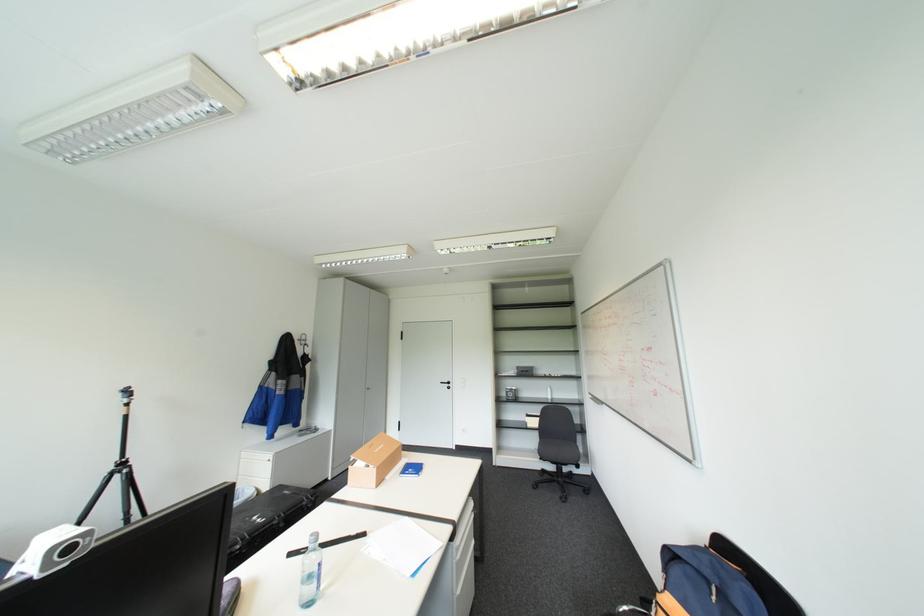
Where is `chair sitting surface`? The height and width of the screenshot is (616, 924). chair sitting surface is located at coordinates (557, 448).